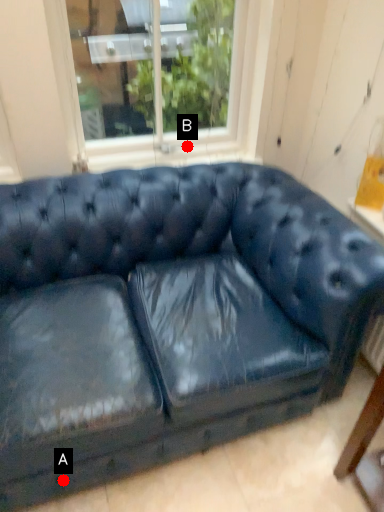
Question: Two points are circled on the image, labeled by A and B beside each circle. Which point is closer to the camera?

Choices:
 (A) A is closer
 (B) B is closer

Answer: (A)